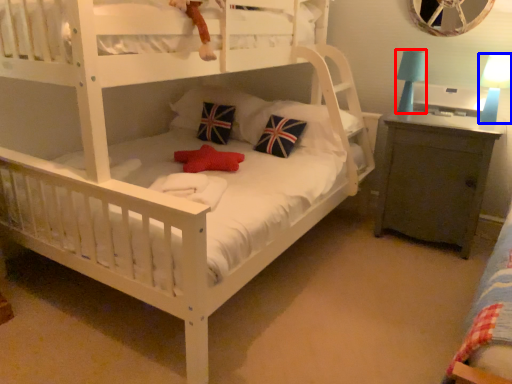
Question: Which object appears farthest to the camera in this image, table lamp (highlighted by a red box) or table lamp (highlighted by a blue box)?

Choices:
 (A) table lamp
 (B) table lamp

Answer: (A)